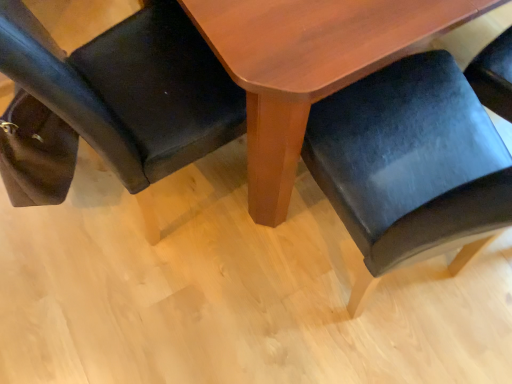
Question: From the image's perspective, would you say matte black chair at lower left, marked as the 2th chair in a right-to-left arrangement, is shown under wooden table at center?

Choices:
 (A) no
 (B) yes

Answer: (B)

Question: Considering the relative sizes of matte black chair at lower left, marked as the 2th chair in a right-to-left arrangement, and wooden table at center in the image provided, is matte black chair at lower left, marked as the 2th chair in a right-to-left arrangement, shorter than wooden table at center?

Choices:
 (A) no
 (B) yes

Answer: (A)

Question: Considering the relative sizes of matte black chair at lower left, marked as the 2th chair in a right-to-left arrangement, and wooden table at center in the image provided, is matte black chair at lower left, marked as the 2th chair in a right-to-left arrangement, taller than wooden table at center?

Choices:
 (A) no
 (B) yes

Answer: (B)

Question: Is matte black chair at lower left, marked as the 2th chair in a right-to-left arrangement, at the left side of wooden table at center?

Choices:
 (A) yes
 (B) no

Answer: (A)

Question: From a real-world perspective, is matte black chair at lower left, the first chair positioned from the left, physically below wooden table at center?

Choices:
 (A) no
 (B) yes

Answer: (A)

Question: From the image's perspective, is matte black chair at lower left, marked as the 2th chair in a right-to-left arrangement, on wooden table at center?

Choices:
 (A) no
 (B) yes

Answer: (A)

Question: Does wooden table at center have a smaller size compared to velvet black chair at lower right, acting as the 2th chair starting from the left?

Choices:
 (A) no
 (B) yes

Answer: (A)

Question: From a real-world perspective, is wooden table at center located higher than velvet black chair at lower right, acting as the 2th chair starting from the left?

Choices:
 (A) no
 (B) yes

Answer: (A)

Question: Is wooden table at center to the left of velvet black chair at lower right, which is counted as the first chair, starting from the right, from the viewer's perspective?

Choices:
 (A) no
 (B) yes

Answer: (A)

Question: Would you say wooden table at center is a long distance from velvet black chair at lower right, acting as the 2th chair starting from the left?

Choices:
 (A) no
 (B) yes

Answer: (A)

Question: Can you confirm if wooden table at center is shorter than velvet black chair at lower right, acting as the 2th chair starting from the left?

Choices:
 (A) no
 (B) yes

Answer: (B)

Question: Can we say wooden table at center lies outside velvet black chair at lower right, which is counted as the first chair, starting from the right?

Choices:
 (A) yes
 (B) no

Answer: (A)

Question: From a real-world perspective, is velvet black chair at lower right, acting as the 2th chair starting from the left, beneath matte black chair at lower left, the first chair positioned from the left?

Choices:
 (A) yes
 (B) no

Answer: (B)